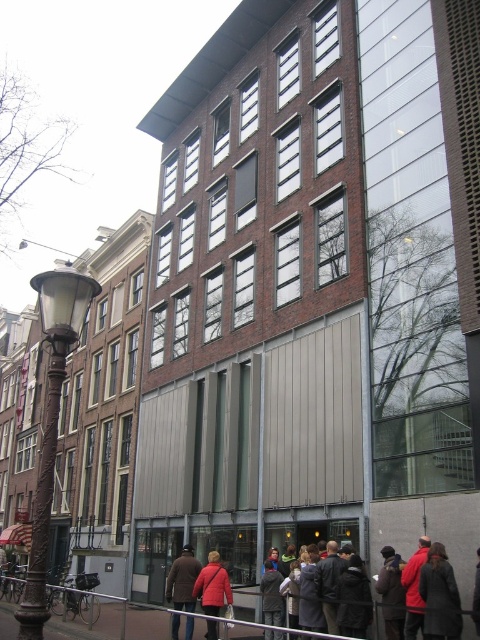
Question: Is bronze textured pole at left further to camera compared to red jacket at center?

Choices:
 (A) no
 (B) yes

Answer: (A)

Question: Does bronze wrought iron streetlamp at left have a greater width compared to bronze textured pole at left?

Choices:
 (A) no
 (B) yes

Answer: (B)

Question: Which is farther from the red jacket at center?

Choices:
 (A) brown leather jacket at lower center
 (B) bronze wrought iron streetlamp at left
 (C) matte red coat at center
 (D) dark gray coat at lower right

Answer: (B)

Question: Which point is farther from the camera taking this photo?

Choices:
 (A) (35, 608)
 (B) (194, 589)

Answer: (B)

Question: Which point is farther from the camera taking this photo?

Choices:
 (A) (428, 600)
 (B) (478, 582)
 (C) (34, 618)

Answer: (A)

Question: Can you confirm if red jacket at center is thinner than matte red coat at center?

Choices:
 (A) no
 (B) yes

Answer: (B)